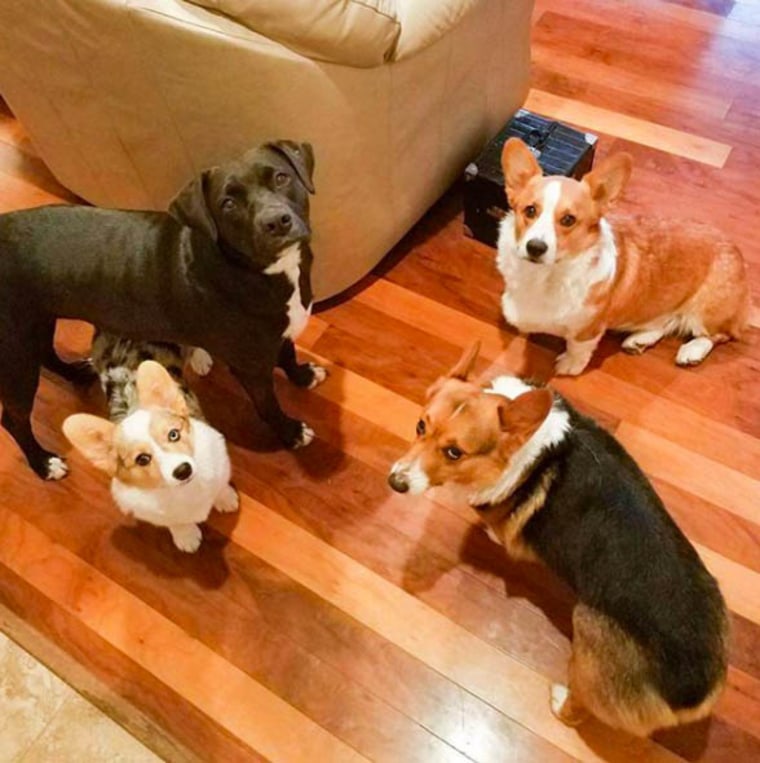
I want to click on sofa, so click(362, 87).